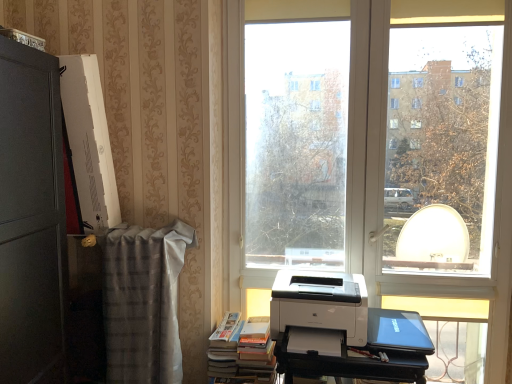
Question: Does transparent glass window at center appear on the right side of black plastic printer at lower right?

Choices:
 (A) yes
 (B) no

Answer: (B)

Question: Are transparent glass window at center and black plastic printer at lower right far apart?

Choices:
 (A) yes
 (B) no

Answer: (B)

Question: Is black plastic printer at lower right inside transparent glass window at center?

Choices:
 (A) no
 (B) yes

Answer: (A)

Question: Is transparent glass window at center shorter than black plastic printer at lower right?

Choices:
 (A) no
 (B) yes

Answer: (A)

Question: Is transparent glass window at center located outside black plastic printer at lower right?

Choices:
 (A) yes
 (B) no

Answer: (A)

Question: In terms of height, does white glossy printer at center look taller or shorter compared to black plastic printer at lower right?

Choices:
 (A) tall
 (B) short

Answer: (B)

Question: Would you say white glossy printer at center is inside or outside black plastic printer at lower right?

Choices:
 (A) outside
 (B) inside

Answer: (A)

Question: Does point (311, 286) appear closer or farther from the camera than point (302, 354)?

Choices:
 (A) closer
 (B) farther

Answer: (B)

Question: In the image, is white glossy printer at center on the left side or the right side of black plastic printer at lower right?

Choices:
 (A) left
 (B) right

Answer: (A)

Question: Relative to white glossy printer at center, is hardcover books at lower left in front or behind?

Choices:
 (A) front
 (B) behind

Answer: (B)

Question: From the image's perspective, relative to white glossy printer at center, is hardcover books at lower left above or below?

Choices:
 (A) below
 (B) above

Answer: (A)

Question: Is point (232, 365) positioned closer to the camera than point (279, 322)?

Choices:
 (A) farther
 (B) closer

Answer: (A)

Question: Based on their positions, is hardcover books at lower left located to the left or right of white glossy printer at center?

Choices:
 (A) right
 (B) left

Answer: (B)

Question: Considering their positions, is transparent glass window at center located in front of or behind black plastic printer at lower right?

Choices:
 (A) front
 (B) behind

Answer: (B)

Question: Considering the positions of point (329, 104) and point (409, 380), is point (329, 104) closer or farther from the camera than point (409, 380)?

Choices:
 (A) farther
 (B) closer

Answer: (A)